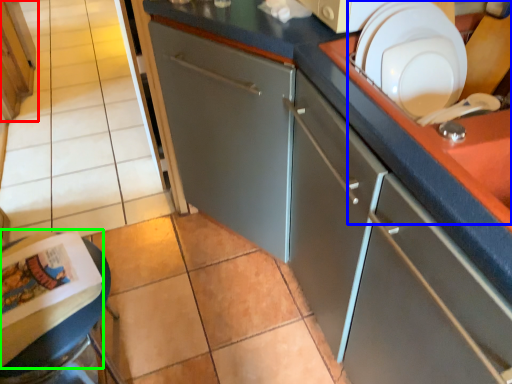
Question: Which is nearer to the cabinetry (highlighted by a red box)? sink (highlighted by a blue box) or magazine (highlighted by a green box).

Choices:
 (A) sink
 (B) magazine

Answer: (B)